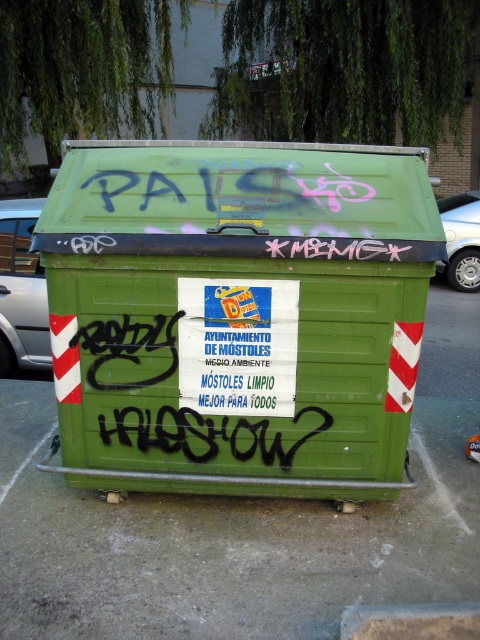
You are a delivery person who needs to park your silver metallic car at left near the green matte recycling bin at center. Can you safely park your car next to the bin without hitting it?

The green matte recycling bin at center has a larger size compared to the silver metallic car at left. Since the bin is larger, there might not be enough space to park the car next to it without risking a collision. Choose a different parking spot.

You are a delivery person trying to park your silver metallic car at left as close as possible to the green matte recycling bin at center to unload packages. According to the scene, what is the closest distance you can get between your car and the recycling bin?

The closest distance you can get between the silver metallic car at left and the green matte recycling bin at center is 3.11 meters, as stated in the description.

You are a parking attendant and need to determine if both cars can fit side by side between the green waste bin and the curb. The green waste bin is 1.2 meters wide. The silver metallic car at left has a width of 1.5 meters, and the silver metallic car at right has a width of 1.8 meters. Can both cars fit side by side between the bin and the curb?

The silver metallic car at left is thinner than the silver metallic car at right. However, the combined width of both cars is 1.5m and 1.8m totaling 3.3 meters. The space available between the bin and the curb is 1.2 meters plus the width of the cars? Wait, I think there might be a misunderstanding in the question. The problem states the green waste bin is 1.2 meters wide, but the question is about fitting both cars between the bin and the curb. The available space would depend on the distance from the bin